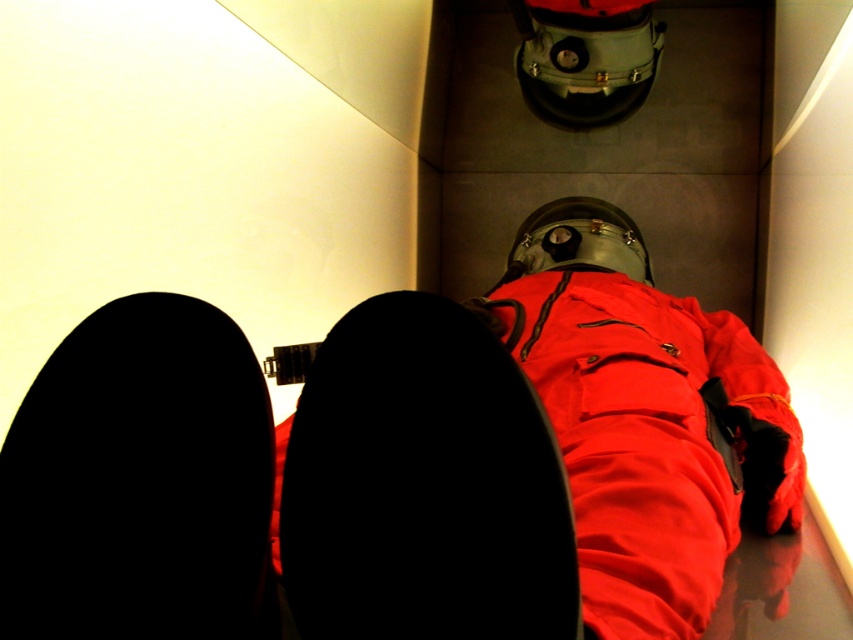
Question: Is black matte shoe at lower left closer to camera compared to matte red jacket at center?

Choices:
 (A) yes
 (B) no

Answer: (A)

Question: Is black matte boot at lower center smaller than matte red jacket at center?

Choices:
 (A) no
 (B) yes

Answer: (B)

Question: Which object is closer to the camera taking this photo?

Choices:
 (A) black matte shoe at lower left
 (B) black matte boot at lower center

Answer: (B)

Question: Does black matte boot at lower center appear on the right side of black matte shoe at lower left?

Choices:
 (A) no
 (B) yes

Answer: (B)

Question: Among these points, which one is farthest from the camera?

Choices:
 (A) (793, 458)
 (B) (554, 333)
 (C) (115, 310)
 (D) (564, 602)

Answer: (B)

Question: Which of these objects is positioned closest to the black matte shoe at lower left?

Choices:
 (A) matte red jacket at center
 (B) black matte boot at lower center
 (C) matte red spacesuit at center

Answer: (B)